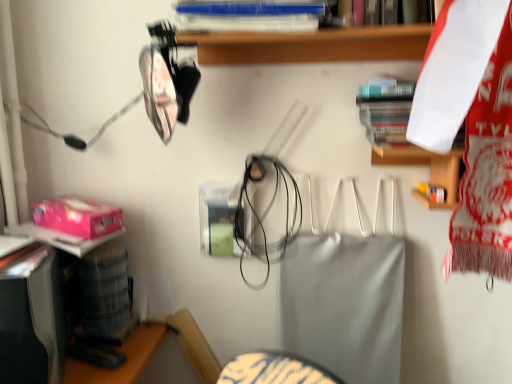
Question: From a real-world perspective, is white plastic shelf at upper center beneath blue plastic book at upper center, which is the second book in bottom-to-top order?

Choices:
 (A) yes
 (B) no

Answer: (A)

Question: From the image's perspective, is white plastic shelf at upper center under blue plastic book at upper center, the 2th book viewed from the right?

Choices:
 (A) yes
 (B) no

Answer: (A)

Question: Considering the relative sizes of white plastic shelf at upper center and blue plastic book at upper center, the 2th book viewed from the right, in the image provided, is white plastic shelf at upper center bigger than blue plastic book at upper center, the 2th book viewed from the right,?

Choices:
 (A) yes
 (B) no

Answer: (A)

Question: Considering the relative sizes of white plastic shelf at upper center and blue plastic book at upper center, which is the second book in bottom-to-top order, in the image provided, is white plastic shelf at upper center thinner than blue plastic book at upper center, which is the second book in bottom-to-top order,?

Choices:
 (A) no
 (B) yes

Answer: (B)

Question: Can you confirm if white plastic shelf at upper center is smaller than blue plastic book at upper center, the 2th book viewed from the right?

Choices:
 (A) yes
 (B) no

Answer: (B)

Question: Is white plastic shelf at upper center shorter than blue plastic book at upper center, the 2th book viewed from the right?

Choices:
 (A) yes
 (B) no

Answer: (B)

Question: From the image's perspective, is hardcover book at upper right, which ranks as the 1th book in bottom-to-top order, above white plastic shelf at upper center?

Choices:
 (A) no
 (B) yes

Answer: (A)

Question: Is hardcover book at upper right, which ranks as the 1th book in bottom-to-top order, facing away from white plastic shelf at upper center?

Choices:
 (A) no
 (B) yes

Answer: (B)

Question: Is hardcover book at upper right, which ranks as the 1th book in bottom-to-top order, at the left side of white plastic shelf at upper center?

Choices:
 (A) yes
 (B) no

Answer: (B)

Question: Is hardcover book at upper right, arranged as the 1th book when viewed from the right, smaller than white plastic shelf at upper center?

Choices:
 (A) no
 (B) yes

Answer: (B)

Question: Is hardcover book at upper right, which is the 2th book from top to bottom, wider than white plastic shelf at upper center?

Choices:
 (A) yes
 (B) no

Answer: (B)

Question: Does blue plastic book at upper center, which is the second book in bottom-to-top order, have a greater width compared to hardcover book at upper right, which appears as the 2th book when viewed from the left?

Choices:
 (A) yes
 (B) no

Answer: (A)